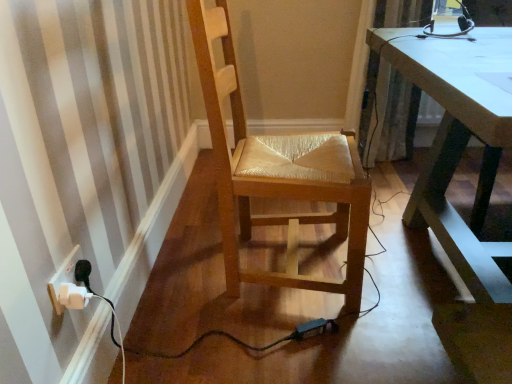
Where is `free point to the left of wooden woven seat at center`? free point to the left of wooden woven seat at center is located at coordinates (179, 274).